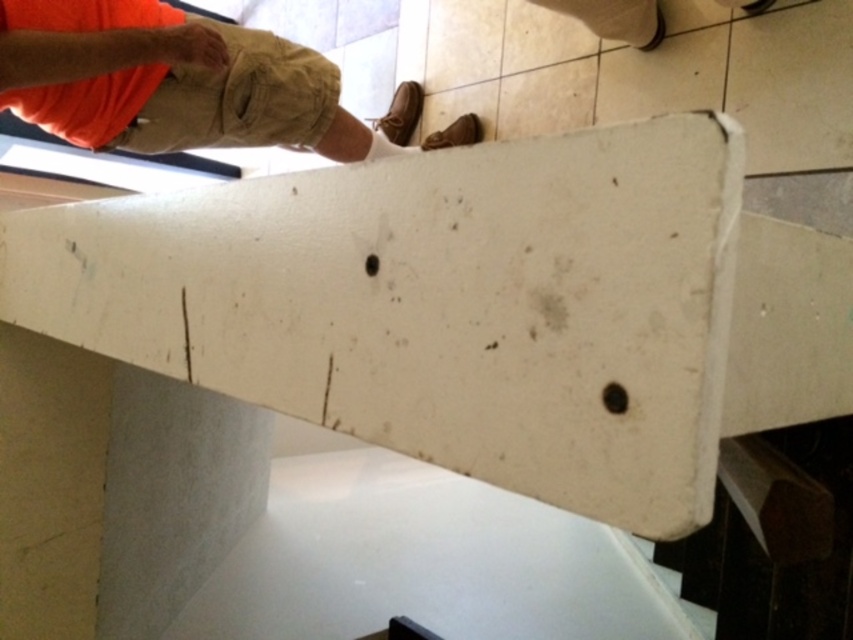
Can you confirm if white matte plank at upper center is thinner than matte orange hand at upper left?

No, white matte plank at upper center is not thinner than matte orange hand at upper left.

Is point (531, 468) more distant than point (161, 36)?

No, it is in front of (161, 36).

This screenshot has height=640, width=853. What are the coordinates of `white matte plank at upper center` in the screenshot? It's located at (438, 305).

In the scene shown: Between orange cotton shirt at upper left and matte orange hand at upper left, which one is positioned higher?

matte orange hand at upper left

Image resolution: width=853 pixels, height=640 pixels. In order to click on orange cotton shirt at upper left in this screenshot , I will do `click(167, 83)`.

Who is positioned more to the left, white matte plank at upper center or orange cotton shirt at upper left?

orange cotton shirt at upper left

Who is more distant from viewer, (670, 516) or (215, 129)?

The point (215, 129) is behind.

I want to click on white matte plank at upper center, so click(x=438, y=305).